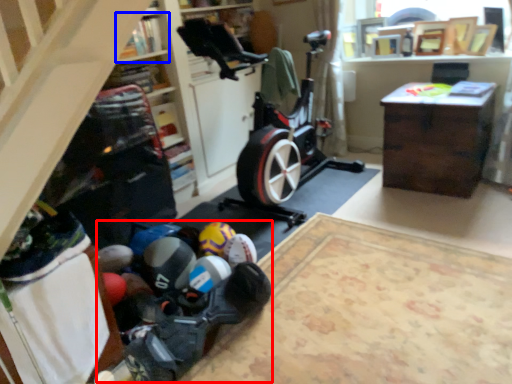
Question: Which of the following is the closest to the observer, toy (highlighted by a red box) or shelf (highlighted by a blue box)?

Choices:
 (A) toy
 (B) shelf

Answer: (A)